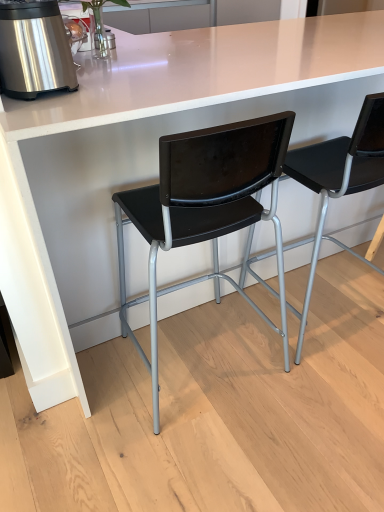
Where is `unoccupied area in front of black plastic chair at center, positioned as the second chair in left-to-right order`? unoccupied area in front of black plastic chair at center, positioned as the second chair in left-to-right order is located at coordinates coord(321,391).